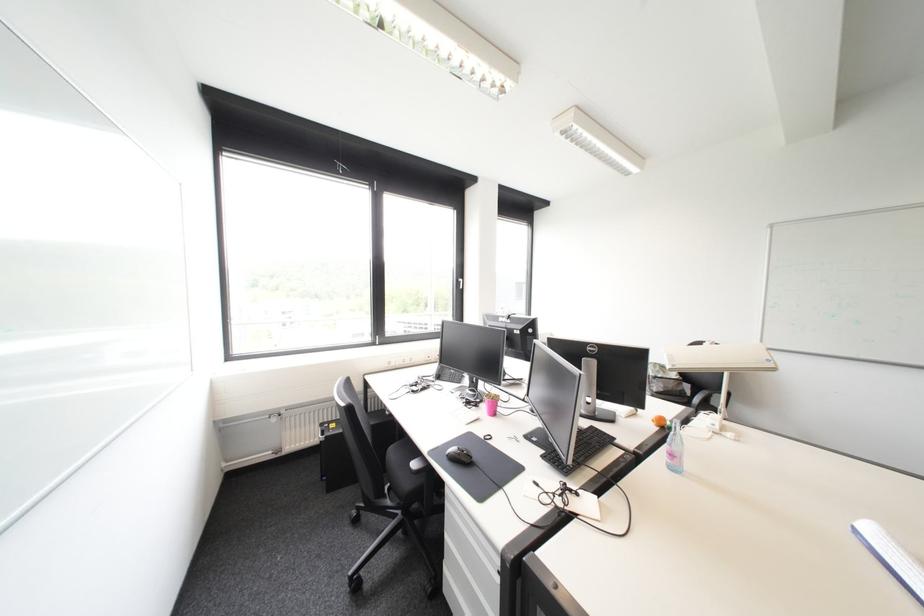
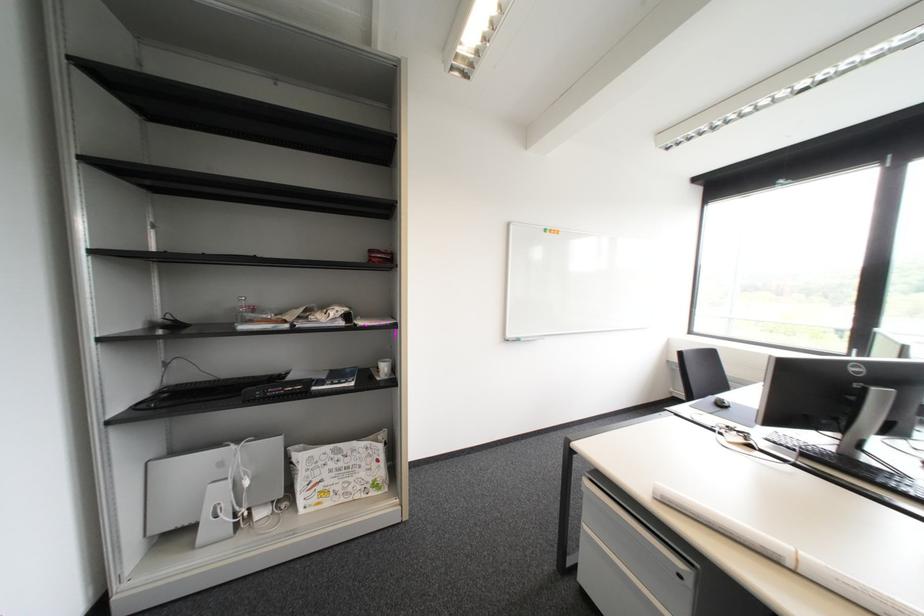
Question: I am providing you with two images of the same scene from different viewpoints. Please identify which objects are invisible in image2.

Choices:
 (A) clear plastic bottle
 (B) cabinet drawer handle
 (C) pink cup
 (D) dresser drawer edge

Answer: (C)